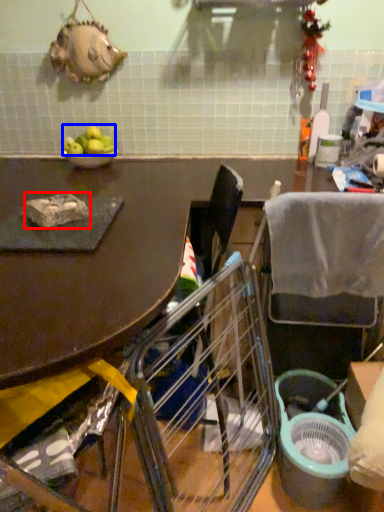
Question: Which of the following is the farthest to the observer, food (highlighted by a red box) or fruit (highlighted by a blue box)?

Choices:
 (A) food
 (B) fruit

Answer: (B)